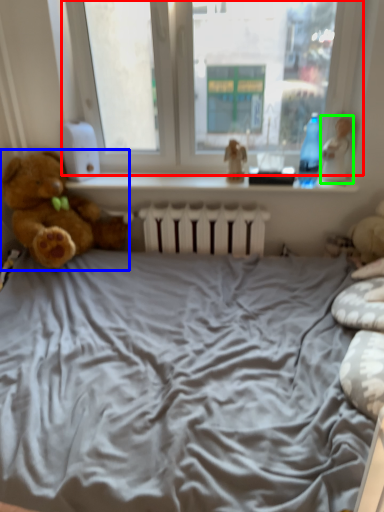
Question: Which is nearer to the window (highlighted by a red box)? teddy bear (highlighted by a blue box) or toy (highlighted by a green box).

Choices:
 (A) teddy bear
 (B) toy

Answer: (B)